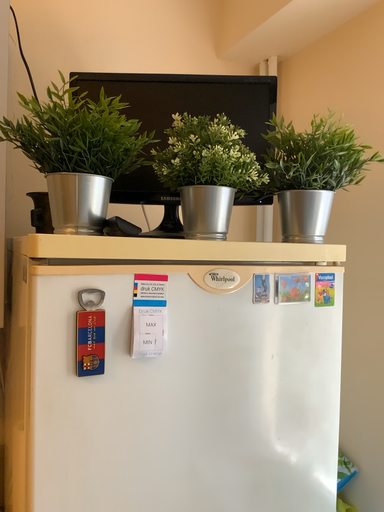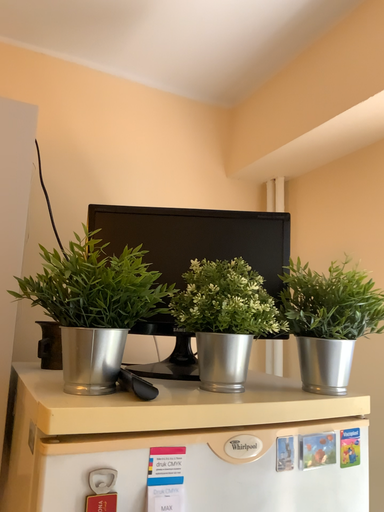
Question: How did the camera likely rotate when shooting the video?

Choices:
 (A) rotated downward
 (B) rotated upward

Answer: (B)